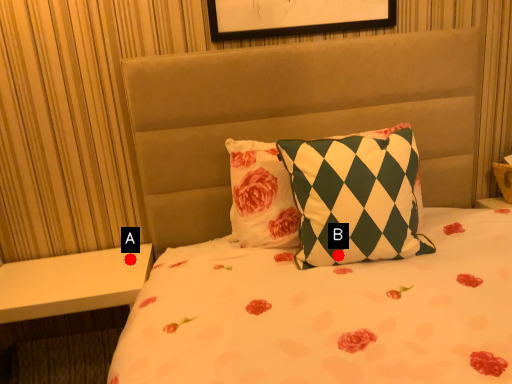
Question: Two points are circled on the image, labeled by A and B beside each circle. Which of the following is the closest to the observer?

Choices:
 (A) A is closer
 (B) B is closer

Answer: (B)